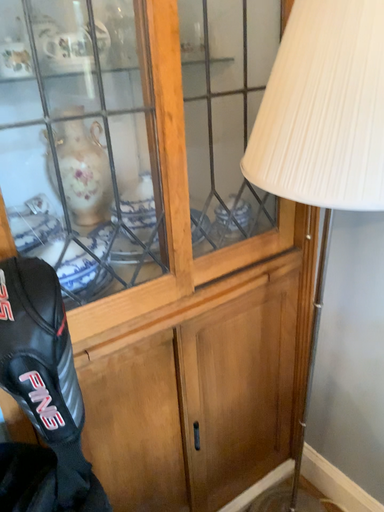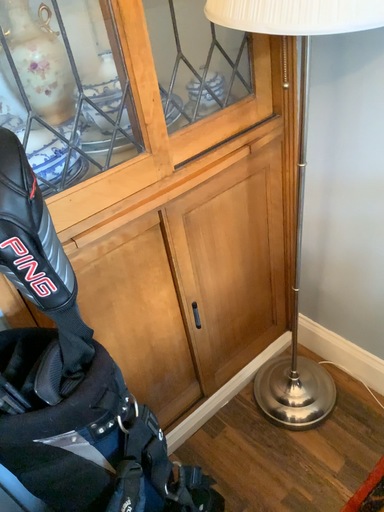
Question: How did the camera likely rotate when shooting the video?

Choices:
 (A) rotated downward
 (B) rotated upward

Answer: (A)